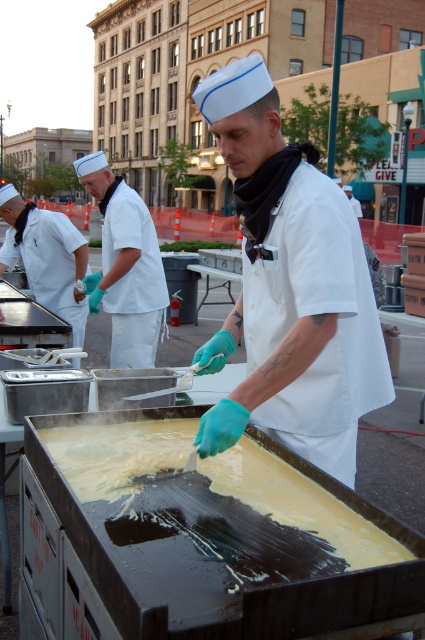
Is yellow matte batter at center thinner than white matte chef hat at upper left?

Yes, yellow matte batter at center is thinner than white matte chef hat at upper left.

From the picture: Which is more to the right, yellow matte batter at center or white matte chef hat at upper left?

yellow matte batter at center is more to the right.

Does point (340, 241) come behind point (34, 244)?

No.

This screenshot has height=640, width=425. I want to click on yellow matte batter at center, so click(291, 289).

Looking at this image, between white matte sailor hat at upper left and white matte chef hat at upper left, which one appears on the left side from the viewer's perspective?

From the viewer's perspective, white matte chef hat at upper left appears more on the left side.

Who is lower down, white matte sailor hat at upper left or white matte chef hat at upper left?

white matte sailor hat at upper left is below.

Which is behind, point (127, 202) or point (85, 260)?

Point (85, 260)

The width and height of the screenshot is (425, 640). Find the location of `white matte sailor hat at upper left`. white matte sailor hat at upper left is located at coordinates (124, 266).

Does yellow matte batter at center lie in front of white matte sailor hat at upper left?

Yes, it is in front of white matte sailor hat at upper left.

Does yellow matte batter at center have a greater width compared to white matte sailor hat at upper left?

Yes.

Is point (317, 460) closer to viewer compared to point (116, 340)?

Yes, point (317, 460) is in front of point (116, 340).

Find the location of `yellow matte batter at center`. yellow matte batter at center is located at coordinates (291, 289).